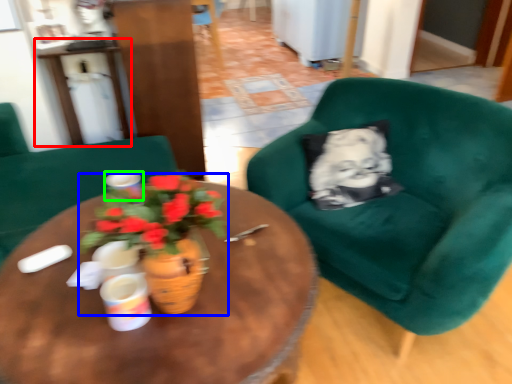
Question: Considering the real-world distances, which object is closest to table (highlighted by a red box)? houseplant (highlighted by a blue box) or coffee cup (highlighted by a green box).

Choices:
 (A) houseplant
 (B) coffee cup

Answer: (B)